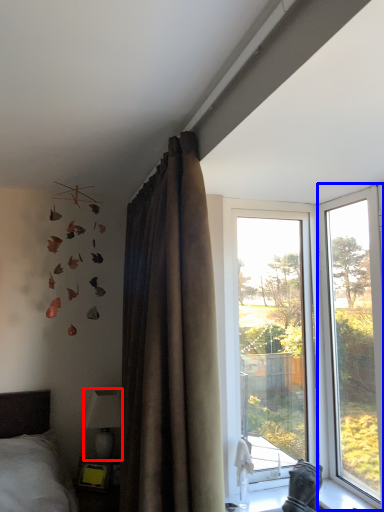
Question: Among these objects, which one is farthest to the camera, lamp (highlighted by a red box) or window (highlighted by a blue box)?

Choices:
 (A) lamp
 (B) window

Answer: (A)